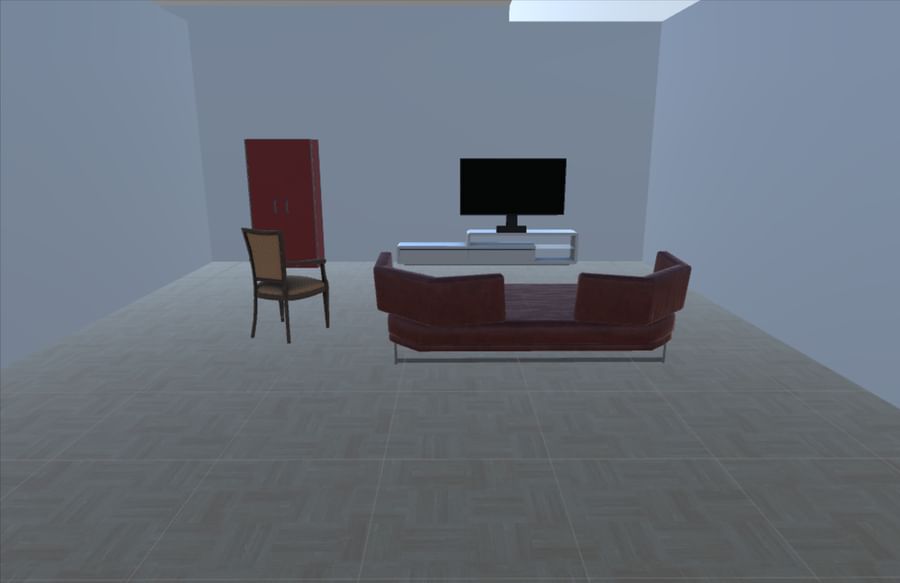
What are the coordinates of `floor` in the screenshot? It's located at (473, 419).